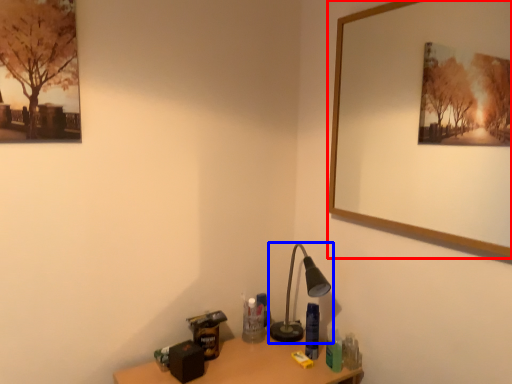
Question: Among these objects, which one is nearest to the camera, picture frame (highlighted by a red box) or lamp (highlighted by a blue box)?

Choices:
 (A) picture frame
 (B) lamp

Answer: (A)